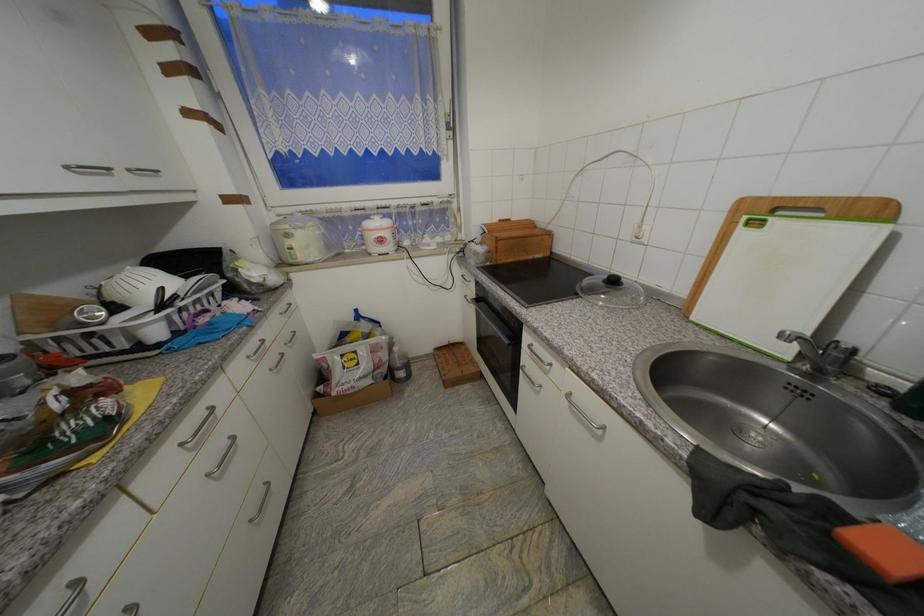
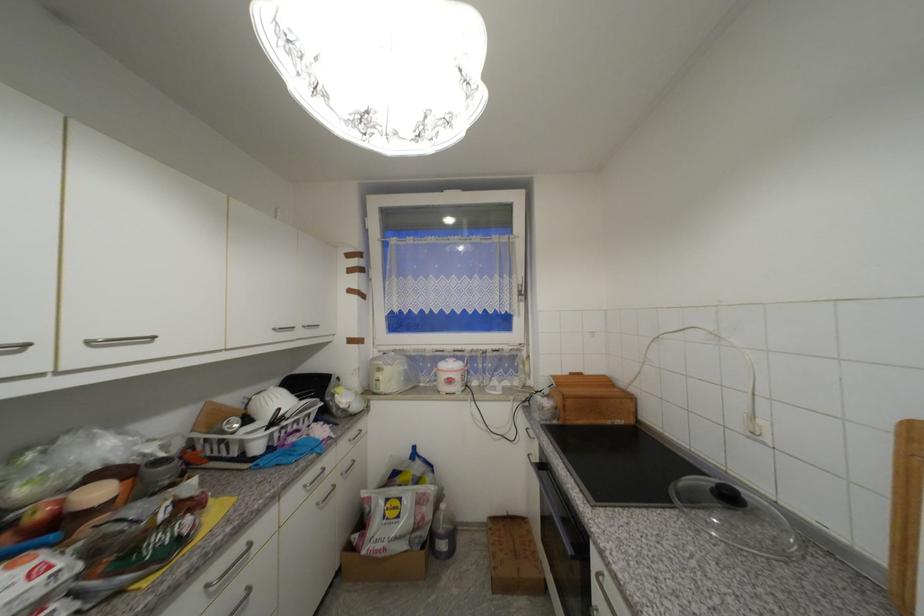
In the second image, find the point that corresponds to pixel 253 359 in the first image.

(310, 488)